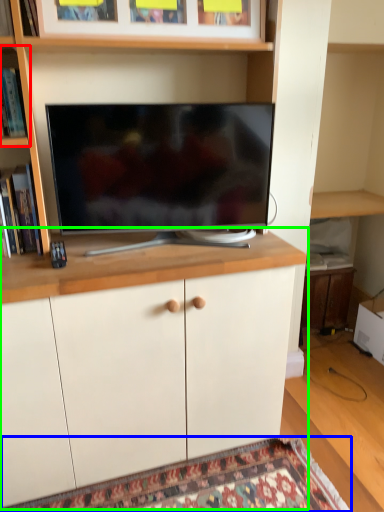
Question: Considering the real-world distances, which object is farthest from shelf (highlighted by a red box)? mat (highlighted by a blue box) or cabinetry (highlighted by a green box)?

Choices:
 (A) mat
 (B) cabinetry

Answer: (A)